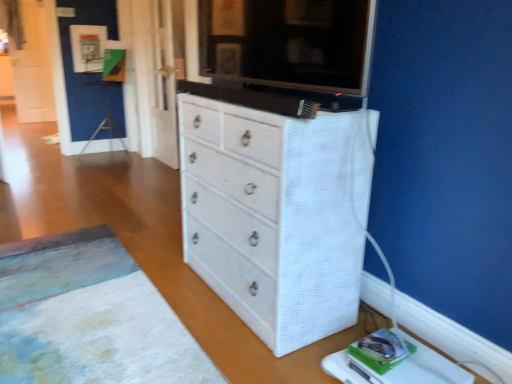
Locate an element on the screen. The width and height of the screenshot is (512, 384). free space that is to the left of white textured chest of drawers at center is located at coordinates (165, 270).